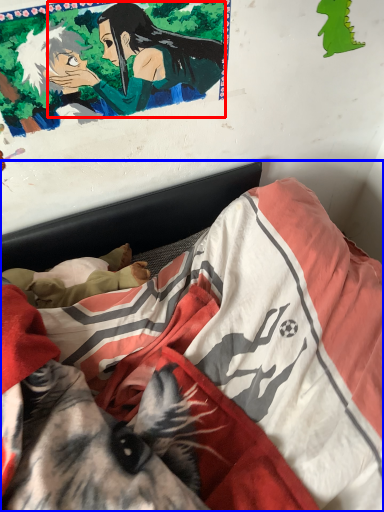
Question: Which object is further to the camera taking this photo, woman (highlighted by a red box) or bed (highlighted by a blue box)?

Choices:
 (A) woman
 (B) bed

Answer: (A)